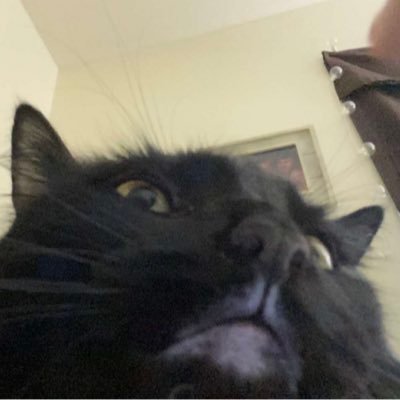
Locate an element on the screen. This screenshot has height=400, width=400. picture frame is located at coordinates (324, 165).